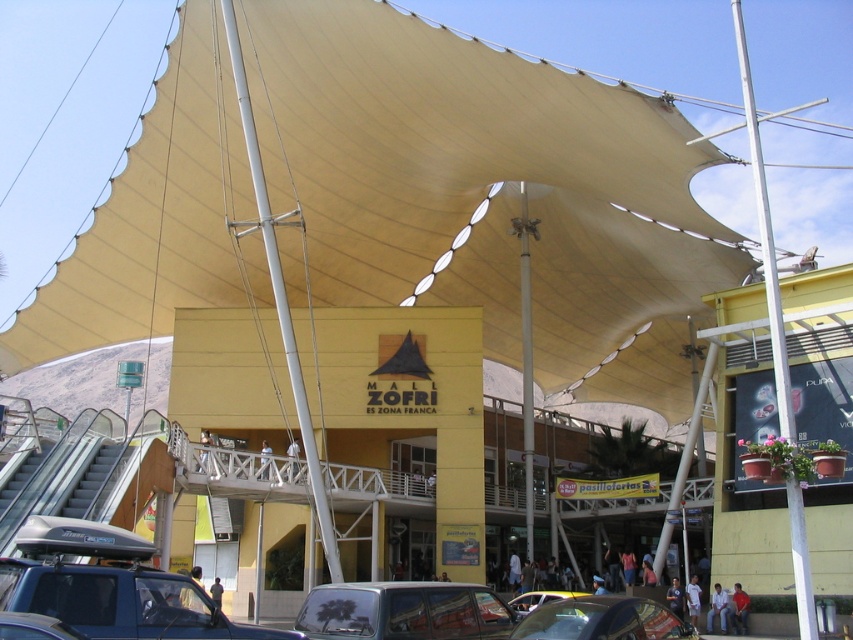
Which is above, shiny black car at center or metallic silver car at center?

shiny black car at center is above.

Does point (555, 632) lie behind point (532, 605)?

No, (555, 632) is closer to viewer.

Does point (607, 595) lie behind point (567, 596)?

No.

Identify the location of shiny black car at center. The image size is (853, 640). (602, 620).

How much distance is there between silver metallic car at center and white metallic pole at right?

silver metallic car at center and white metallic pole at right are 32.60 meters apart from each other.

Which of these two, silver metallic car at center or white metallic pole at right, stands shorter?

silver metallic car at center is shorter.

Describe the element at coordinates (404, 611) in the screenshot. The image size is (853, 640). I see `silver metallic car at center` at that location.

The height and width of the screenshot is (640, 853). I want to click on silver metallic car at center, so click(404, 611).

Which is above, white metallic pole at right or metallic silver car at center?

white metallic pole at right is above.

Is white metallic pole at right below metallic silver car at center?

Incorrect, white metallic pole at right is not positioned below metallic silver car at center.

Describe the element at coordinates (764, 240) in the screenshot. This screenshot has width=853, height=640. I see `white metallic pole at right` at that location.

Image resolution: width=853 pixels, height=640 pixels. I want to click on white metallic pole at right, so click(x=764, y=240).